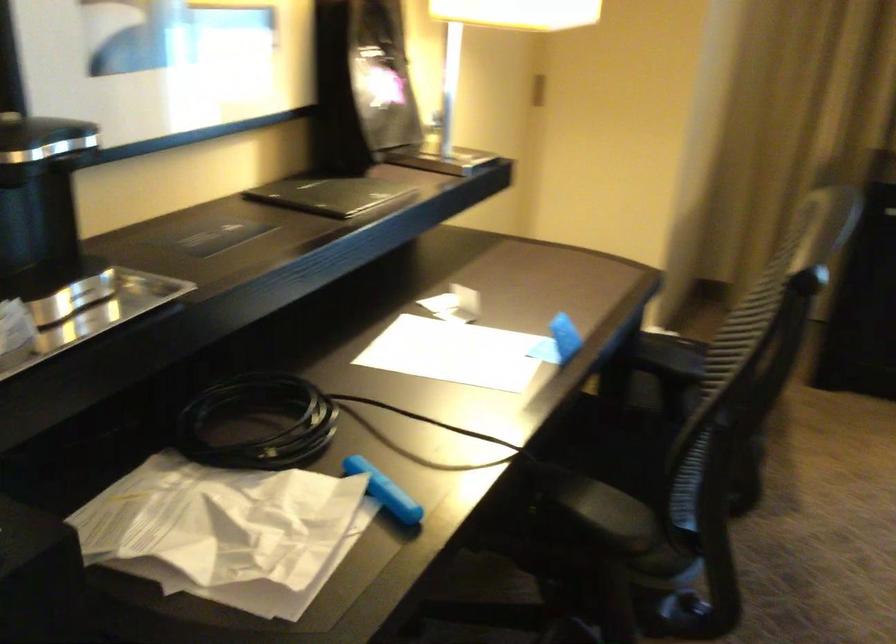
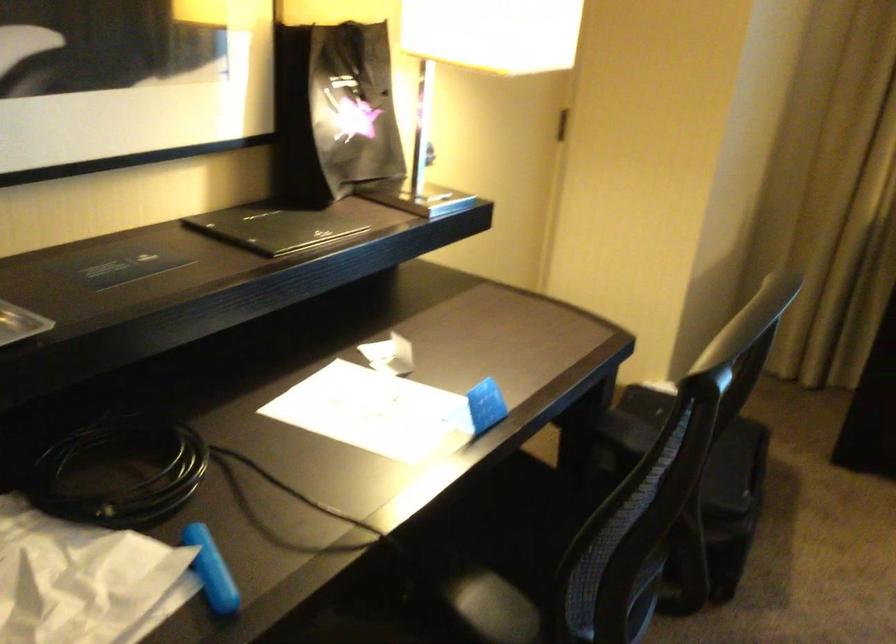
Locate, in the second image, the point that corresponds to (561,339) in the first image.

(479, 408)